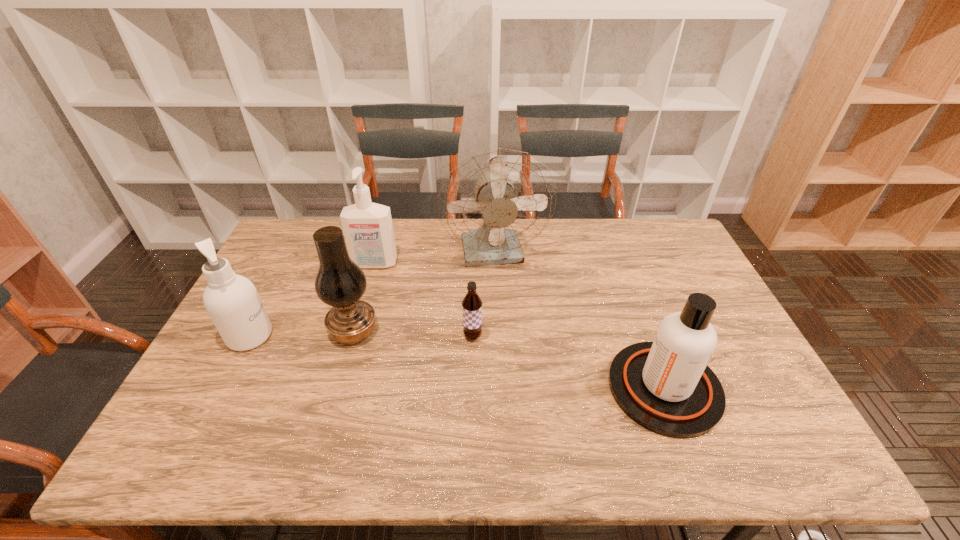
Locate an element on the screen. This screenshot has height=540, width=960. blank area located on the left of the rightmost cleansing agent is located at coordinates (477, 388).

Where is `free spot located 0.290m on the front of the root beer`? Image resolution: width=960 pixels, height=540 pixels. free spot located 0.290m on the front of the root beer is located at coordinates (470, 443).

At what (x,y) coordinates should I click in order to perform the action: click on fan situated at the far edge. Please return your answer as a coordinate pair (x, y). This screenshot has height=540, width=960. Looking at the image, I should click on (494, 202).

I want to click on cleansing agent located at the far edge, so click(x=368, y=230).

Find the location of a particular element. object present at the near edge is located at coordinates (665, 386).

You are a GUI agent. You are given a task and a screenshot of the screen. Output one action in this format:
    pyautogui.click(x=<x>, y=<y>)
    Task: Click on the object present at the left edge
    
    Given the screenshot: What is the action you would take?
    pyautogui.click(x=232, y=301)

You are a GUI agent. You are given a task and a screenshot of the screen. Output one action in this format:
    pyautogui.click(x=<x>, y=<y>)
    Task: Click on the object present at the right edge
    
    Given the screenshot: What is the action you would take?
    pyautogui.click(x=665, y=386)

Where is `object present at the near right corner`? object present at the near right corner is located at coordinates pos(665,386).

At what (x,y) coordinates should I click in order to perform the action: click on free space at the far edge of the desktop. Please return your answer as a coordinate pair (x, y). The width and height of the screenshot is (960, 540). Looking at the image, I should click on (607, 259).

In the image, there is a desktop. Where is `vacant space at the near edge`? vacant space at the near edge is located at coordinates (280, 446).